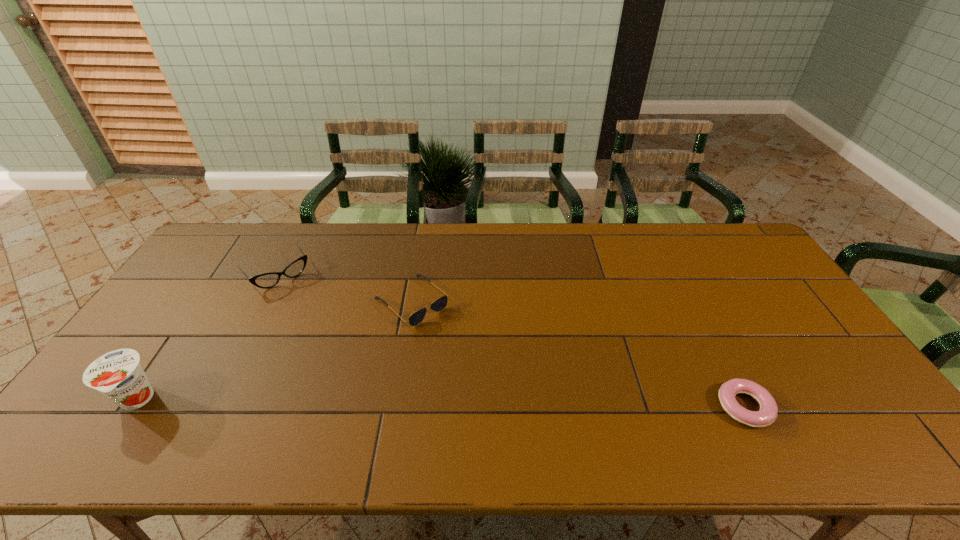
Identify the location of object present at the near left corner. The image size is (960, 540). (118, 375).

Find the location of `vacant region at the far edge of the desktop`. vacant region at the far edge of the desktop is located at coordinates (407, 227).

This screenshot has height=540, width=960. In the image, there is a desktop. In order to click on vacant space at the near edge in this screenshot , I will do `click(607, 404)`.

Identify the location of vacant space at the left edge of the desktop. Image resolution: width=960 pixels, height=540 pixels. (219, 299).

The image size is (960, 540). Identify the location of vacant space at the right edge. (773, 332).

Image resolution: width=960 pixels, height=540 pixels. Identify the location of vacant region at the far left corner of the desktop. (215, 259).

Identify the location of free space at the far right corner of the desktop. The height and width of the screenshot is (540, 960). (706, 242).

In the image, there is a desktop. Identify the location of vacant region at the near right corner. (851, 406).

The image size is (960, 540). I want to click on vacant area that lies between the yogurt and the third object from left to right, so click(x=274, y=350).

Locate an element on the screen. free point between the rightmost object and the second shortest object is located at coordinates (578, 354).